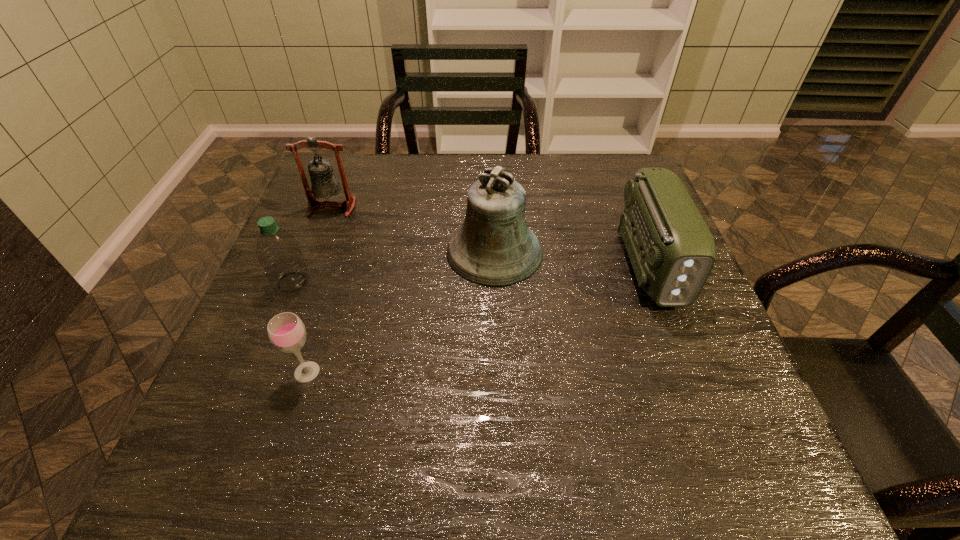
Find the location of `vacant space at the near edge of the desktop`. vacant space at the near edge of the desktop is located at coordinates (632, 468).

Find the location of `vacant area at the left edge`. vacant area at the left edge is located at coordinates (209, 405).

The image size is (960, 540). In order to click on blank area at the far left corner in this screenshot , I will do `click(355, 161)`.

Where is `free space at the far right corner of the desktop`? Image resolution: width=960 pixels, height=540 pixels. free space at the far right corner of the desktop is located at coordinates (601, 160).

Locate an element on the screen. Image resolution: width=960 pixels, height=540 pixels. free space at the near right corner is located at coordinates (737, 489).

At what (x,y) coordinates should I click in order to perform the action: click on vacant area that lies between the wineglass and the farthest object. Please return your answer as a coordinate pair (x, y). Looking at the image, I should click on (320, 290).

This screenshot has height=540, width=960. In order to click on free spot between the water bottle and the second object from right to left in this screenshot , I will do `click(394, 267)`.

The width and height of the screenshot is (960, 540). Find the location of `unoccupied area between the radio_receiver and the right bell`. unoccupied area between the radio_receiver and the right bell is located at coordinates tap(572, 258).

Identify the location of free space that is in between the farther bell and the nearest object. This screenshot has width=960, height=540. (320, 290).

What are the coordinates of `free space between the second object from right to left and the water bottle` in the screenshot? It's located at (394, 267).